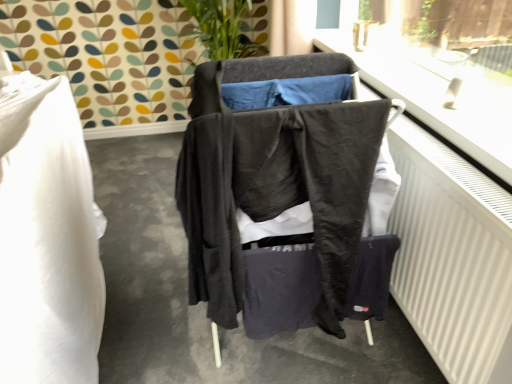
Question: Is white matte radiator at right to the right of matte black clothing at center from the viewer's perspective?

Choices:
 (A) yes
 (B) no

Answer: (A)

Question: Is white matte radiator at right not inside matte black clothing at center?

Choices:
 (A) no
 (B) yes

Answer: (B)

Question: Is white matte radiator at right behind matte black clothing at center?

Choices:
 (A) yes
 (B) no

Answer: (B)

Question: Can you confirm if white matte radiator at right is shorter than matte black clothing at center?

Choices:
 (A) yes
 (B) no

Answer: (B)

Question: From the image's perspective, is white matte radiator at right on matte black clothing at center?

Choices:
 (A) no
 (B) yes

Answer: (A)

Question: Is point (401, 56) positioned closer to the camera than point (239, 180)?

Choices:
 (A) closer
 (B) farther

Answer: (B)

Question: In terms of size, does white plastic window frame at upper right appear bigger or smaller than dark gray fabric jacket at center?

Choices:
 (A) small
 (B) big

Answer: (A)

Question: Is white plastic window frame at upper right wider or thinner than dark gray fabric jacket at center?

Choices:
 (A) thin
 (B) wide

Answer: (A)

Question: Is white plastic window frame at upper right taller or shorter than dark gray fabric jacket at center?

Choices:
 (A) short
 (B) tall

Answer: (A)

Question: From the image's perspective, is white matte radiator at right above or below dark gray fabric jacket at center?

Choices:
 (A) below
 (B) above

Answer: (A)

Question: Is white matte radiator at right wider or thinner than dark gray fabric jacket at center?

Choices:
 (A) wide
 (B) thin

Answer: (B)

Question: Choose the correct answer: Is white matte radiator at right inside dark gray fabric jacket at center or outside it?

Choices:
 (A) outside
 (B) inside

Answer: (A)

Question: Is white matte radiator at right in front of or behind dark gray fabric jacket at center in the image?

Choices:
 (A) behind
 (B) front

Answer: (B)

Question: From a real-world perspective, is matte black clothing at center positioned above or below white plastic window frame at upper right?

Choices:
 (A) below
 (B) above

Answer: (A)

Question: From the image's perspective, is matte black clothing at center located above or below white plastic window frame at upper right?

Choices:
 (A) below
 (B) above

Answer: (A)